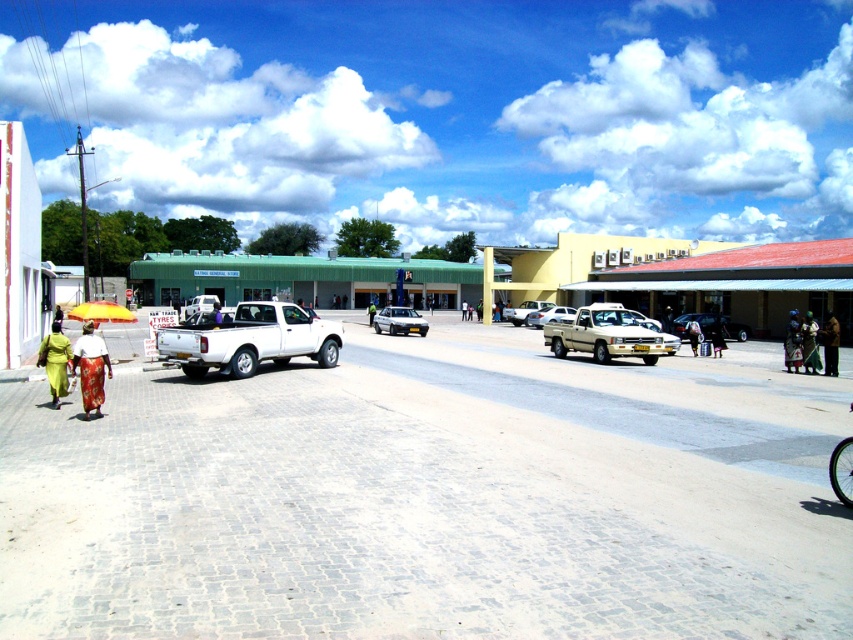
You are a customer at the market and see the matte yellow umbrella at lower left and the brown fabric bag at right. Which item is positioned lower in the image?

The matte yellow umbrella at lower left is positioned lower than the brown fabric bag at right.

You are standing at the point closest to the yellow building with a red roof. There are two points marked in the image, one at coordinates point (x=732, y=332) and the other at point (x=844, y=449). Which point is closer to you?

Point (x=844, y=449) is closer to you because it is in front of point (x=732, y=332).